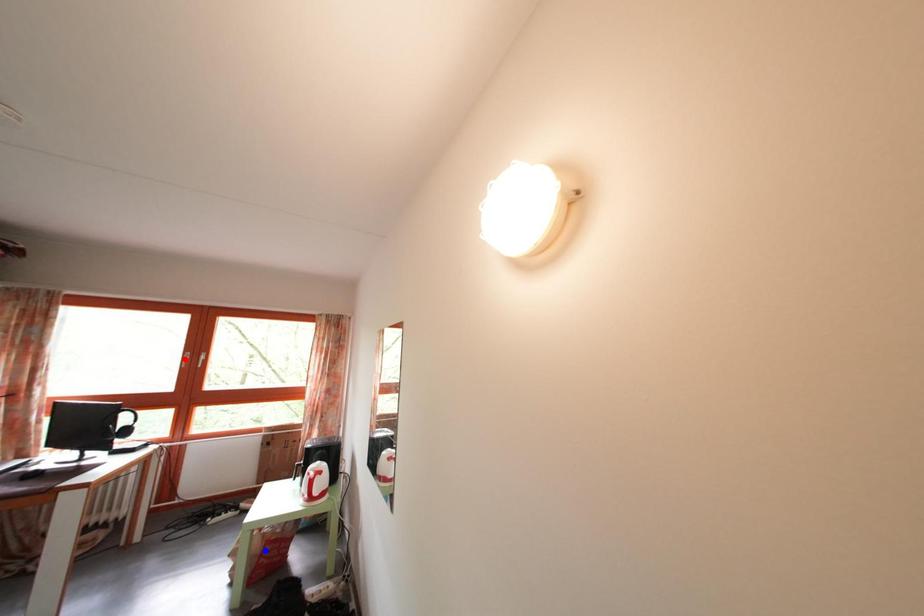
Question: Two points are marked on the image. Which point is closer to the camera?

Choices:
 (A) Blue point is closer.
 (B) Red point is closer.

Answer: (A)